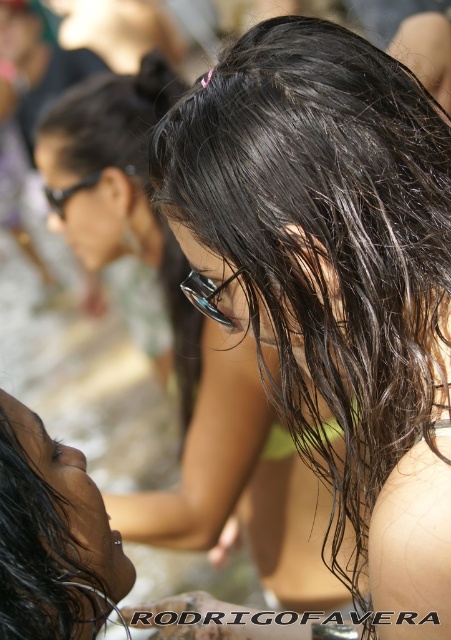
Question: Is white matte bikini top at center wider than black plastic glasses at upper left?

Choices:
 (A) no
 (B) yes

Answer: (A)

Question: Which point is farther to the camera?

Choices:
 (A) (336, 435)
 (B) (59, 624)
 (C) (133, 168)
 (D) (330, 364)

Answer: (C)

Question: Can you confirm if wet hair at center is positioned below shiny black hair at lower left?

Choices:
 (A) yes
 (B) no

Answer: (B)

Question: Among these objects, which one is nearest to the camera?

Choices:
 (A) clear plastic goggles at center
 (B) wet hair at center

Answer: (B)

Question: Which point is closer to the camera?

Choices:
 (A) (47, 186)
 (B) (277, 83)
 (C) (210, 280)
 (D) (38, 548)

Answer: (B)

Question: Is wet hair at center to the left of white matte bikini top at center from the viewer's perspective?

Choices:
 (A) no
 (B) yes

Answer: (A)